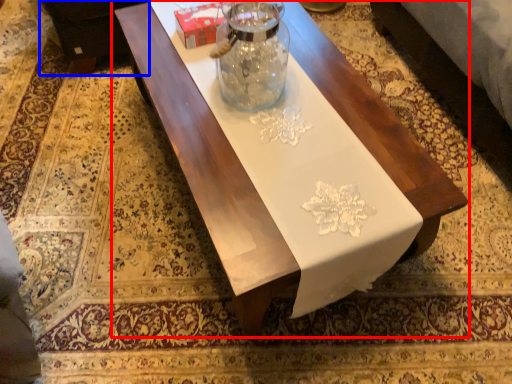
Question: Which of the following is the farthest to the observer, table (highlighted by a red box) or couch (highlighted by a blue box)?

Choices:
 (A) table
 (B) couch

Answer: (B)